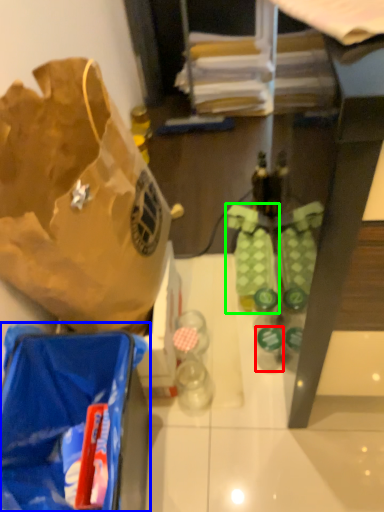
Question: Which object is positioned farthest from bottle (highlighted by a red box)? Select from luggage and bags (highlighted by a blue box) and footwear (highlighted by a green box).

Choices:
 (A) luggage and bags
 (B) footwear

Answer: (A)